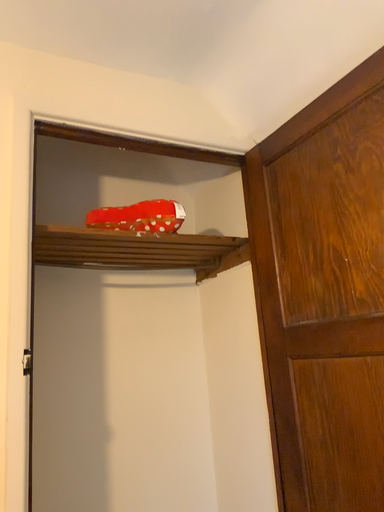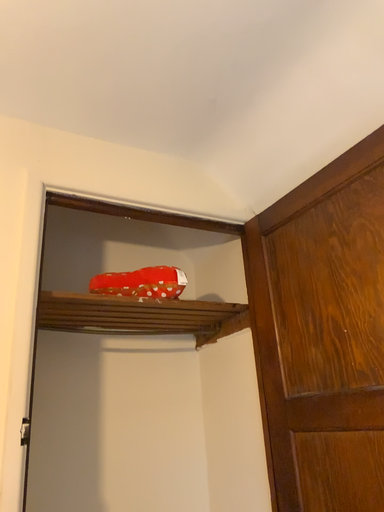
Question: Which way did the camera rotate in the video?

Choices:
 (A) rotated upward
 (B) rotated downward

Answer: (A)